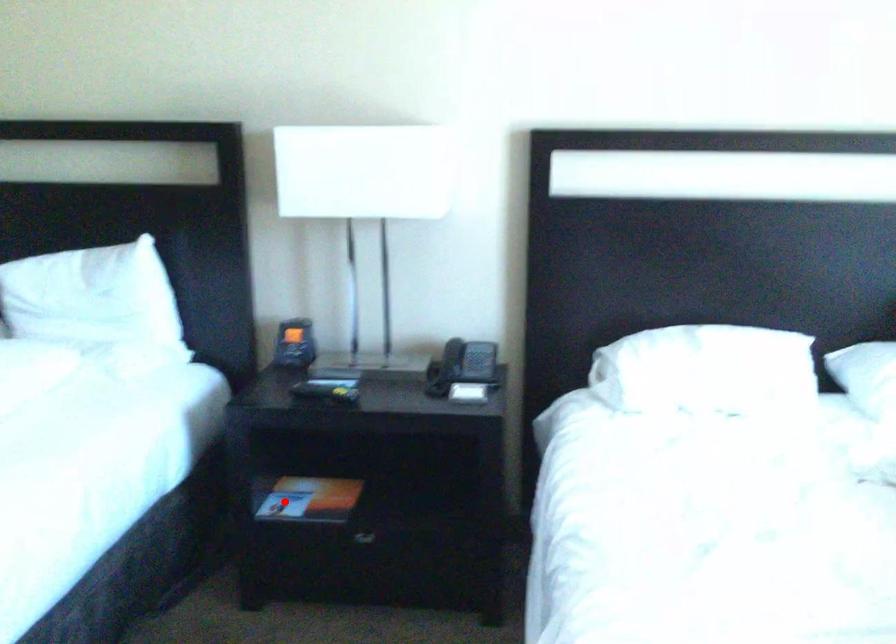
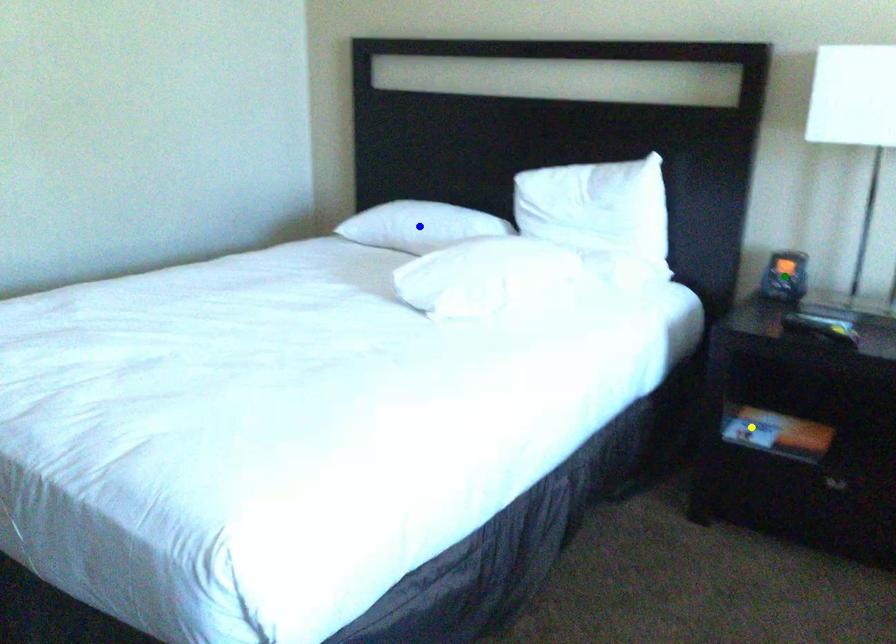
Question: I am providing you with two images of the same scene from different viewpoints. A red point is marked on the first image. You are given multiple points on the second image. Which point in image 2 is actually the same real-world point as the red point in image 1?

Choices:
 (A) yellow point
 (B) green point
 (C) blue point

Answer: (A)